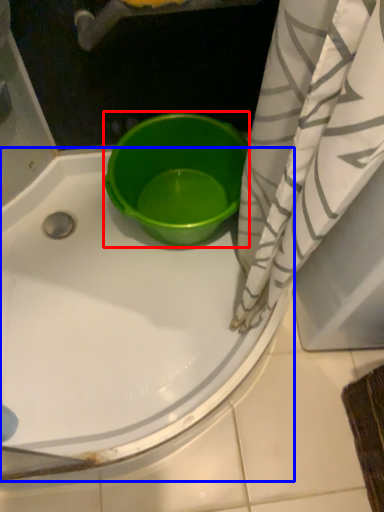
Question: Which object is closer to the camera taking this photo, basin (highlighted by a red box) or bathtub (highlighted by a blue box)?

Choices:
 (A) basin
 (B) bathtub

Answer: (B)